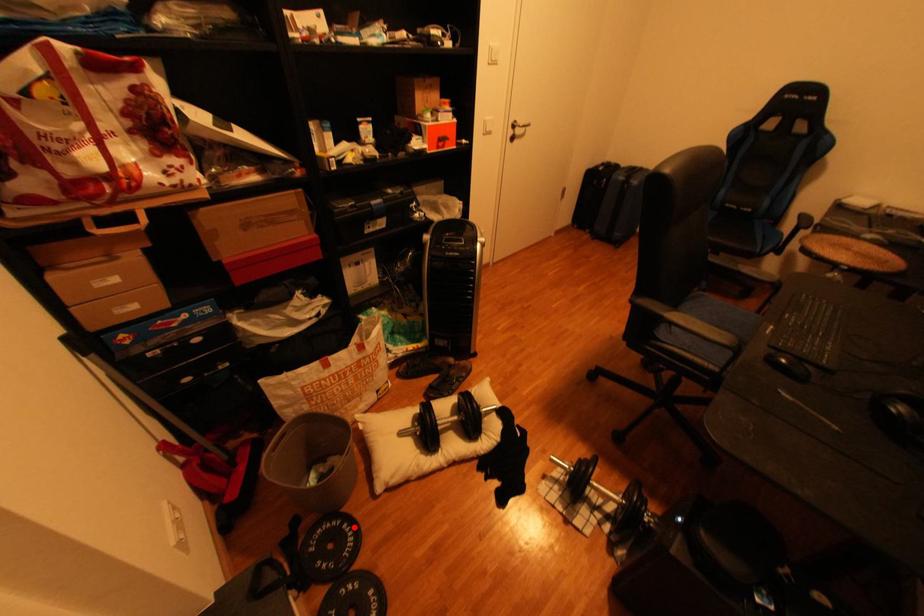
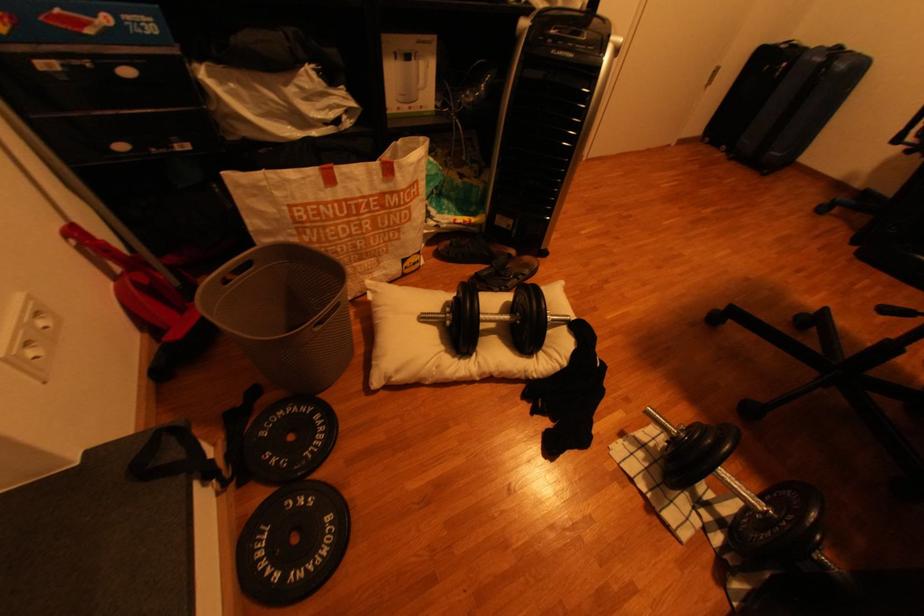
Question: I am providing you with two images of the same scene from different viewpoints. A red point is marked on the first image. Can you still see the location of the red point in image 2?

Choices:
 (A) Yes
 (B) No

Answer: (A)